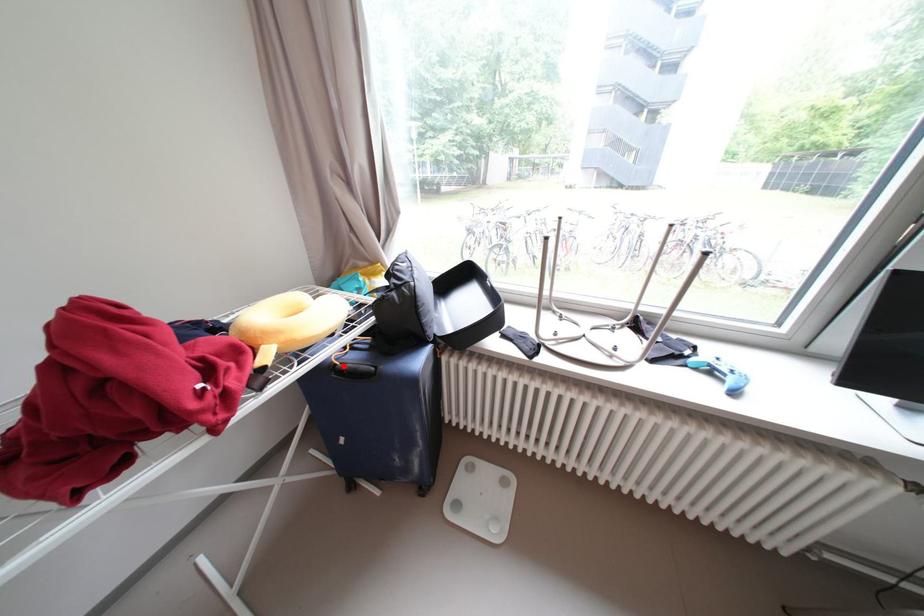
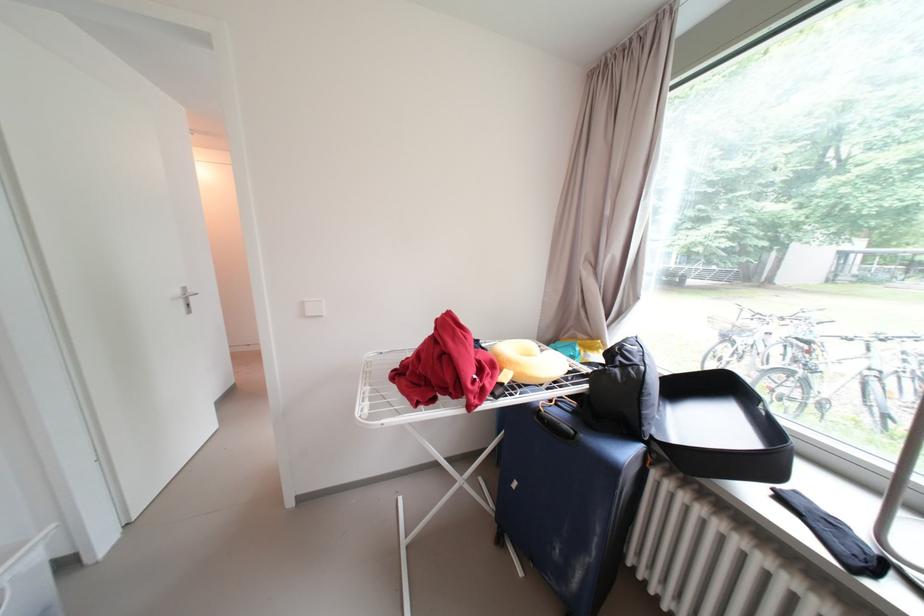
Question: I am providing you with two images of the same scene from different viewpoints. A red point is shown in image1. For the corresponding object point in image2, is it positioned nearer or farther from the camera?

Choices:
 (A) Nearer
 (B) Farther

Answer: (B)